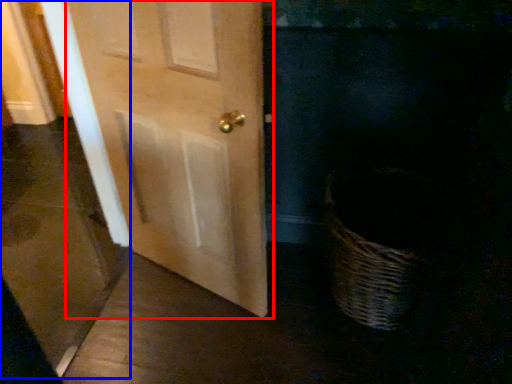
Question: Which object appears farthest to the camera in this image, door (highlighted by a red box) or screen door (highlighted by a blue box)?

Choices:
 (A) door
 (B) screen door

Answer: (A)